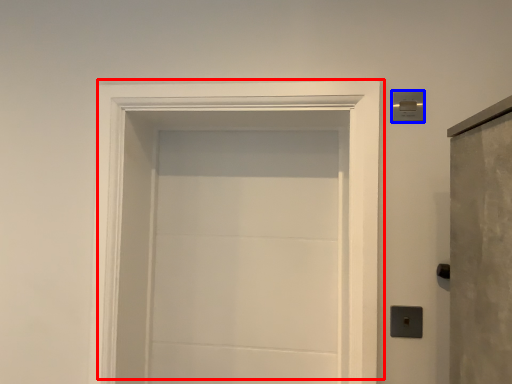
Question: Which of the following is the closest to the observer, door (highlighted by a red box) or light switch (highlighted by a blue box)?

Choices:
 (A) door
 (B) light switch

Answer: (A)